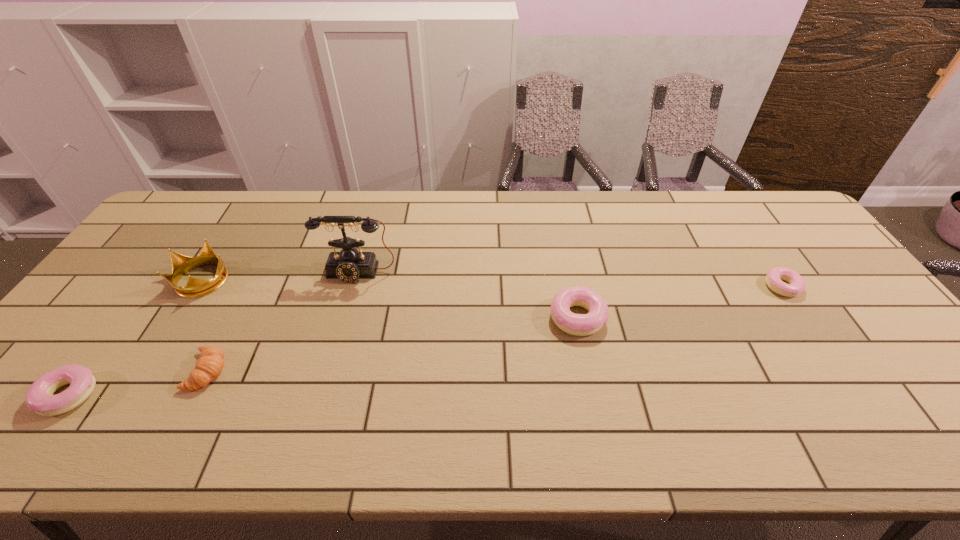
Locate an element on the screen. the second tallest doughnut is located at coordinates (39, 398).

Where is `the leftmost doughnut`? The width and height of the screenshot is (960, 540). the leftmost doughnut is located at coordinates (39, 398).

In order to click on the second doughnut from left to right in this screenshot , I will do `click(575, 324)`.

This screenshot has width=960, height=540. I want to click on the fourth shortest object, so click(575, 324).

Identify the location of the shortest doughnut. (774, 277).

The image size is (960, 540). Identify the location of the shortest object. (774, 277).

At what (x,y) coordinates should I click in order to perform the action: click on the third object from right to left. Please return your answer as a coordinate pair (x, y). Image resolution: width=960 pixels, height=540 pixels. Looking at the image, I should click on (348, 265).

Locate an element on the screen. the tallest object is located at coordinates (348, 265).

The height and width of the screenshot is (540, 960). Identify the location of the fifth shortest object. click(181, 264).

Locate an element on the screen. The width and height of the screenshot is (960, 540). crown is located at coordinates (181, 264).